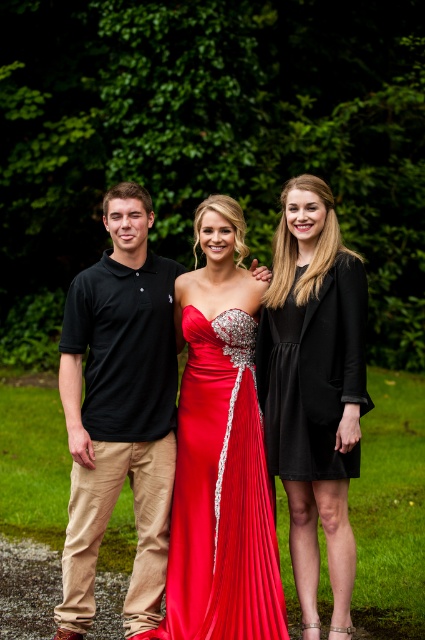
You are a photographer setting up for a group photo in the park. You have two markers placed at point (138,492) and point (334,432). If you want to position a third marker so that it is in front of both existing markers, where should you place it relative to the two points?

To place a third marker in front of both point (138,492) and point (334,432), it should be positioned closer to the photographer than both points. Since point (138,492) is behind point (334,432), the new marker needs to be placed in front of point (334,432), ensuring it is the closest to the photographer among all three markers.

You are a fashion designer observing the three people in the image. You need to determine which of the two black clothing items, the black cotton polo shirt at left or the black matte dress at right, is taller. Which one is taller?

The black cotton polo shirt at left is taller than the black matte dress at right.